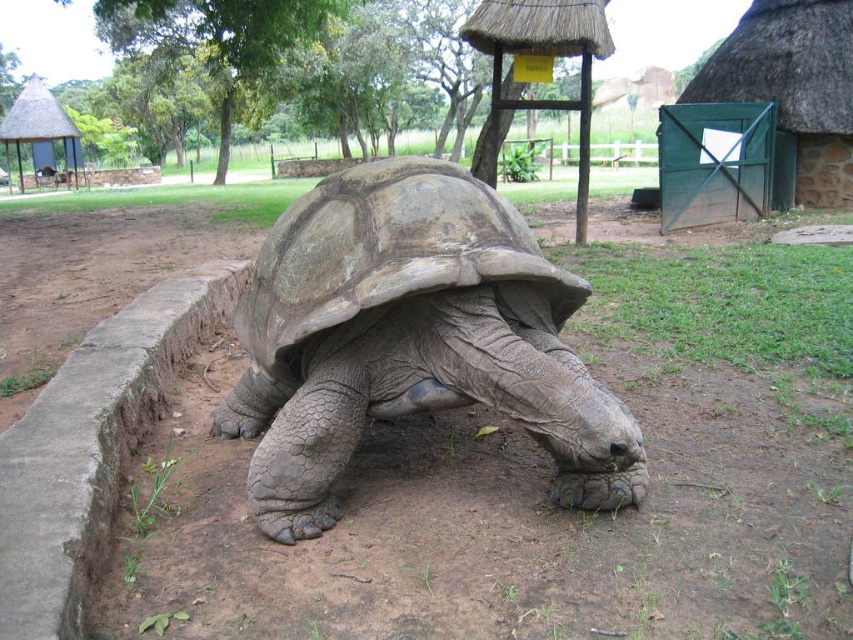
Consider the image. Who is shorter, brown dirt field at center or thatched straw hut at upper left?

Standing shorter between the two is brown dirt field at center.

Locate an element on the screen. The image size is (853, 640). brown dirt field at center is located at coordinates (537, 490).

Does point (732, 600) come behind point (68, 138)?

That is False.

Find the location of a particular element. brown dirt field at center is located at coordinates (537, 490).

Consider the image. How much distance is there between leathery brown tortoise at center and thatched straw hut at upper left?

19.33 meters

Who is more distant from viewer, (489, 314) or (15, 108)?

Point (15, 108)

Who is more distant from viewer, (x=311, y=323) or (x=13, y=138)?

Positioned behind is point (x=13, y=138).

Locate an element on the screen. The image size is (853, 640). leathery brown tortoise at center is located at coordinates (410, 339).

Is leathery brown tortoise at center wider than green thatched roof at upper right?

Incorrect, leathery brown tortoise at center's width does not surpass green thatched roof at upper right's.

Does leathery brown tortoise at center appear under green thatched roof at upper right?

Correct, leathery brown tortoise at center is located below green thatched roof at upper right.

At what (x,y) coordinates should I click in order to perform the action: click on leathery brown tortoise at center. Please return your answer as a coordinate pair (x, y). Looking at the image, I should click on (410, 339).